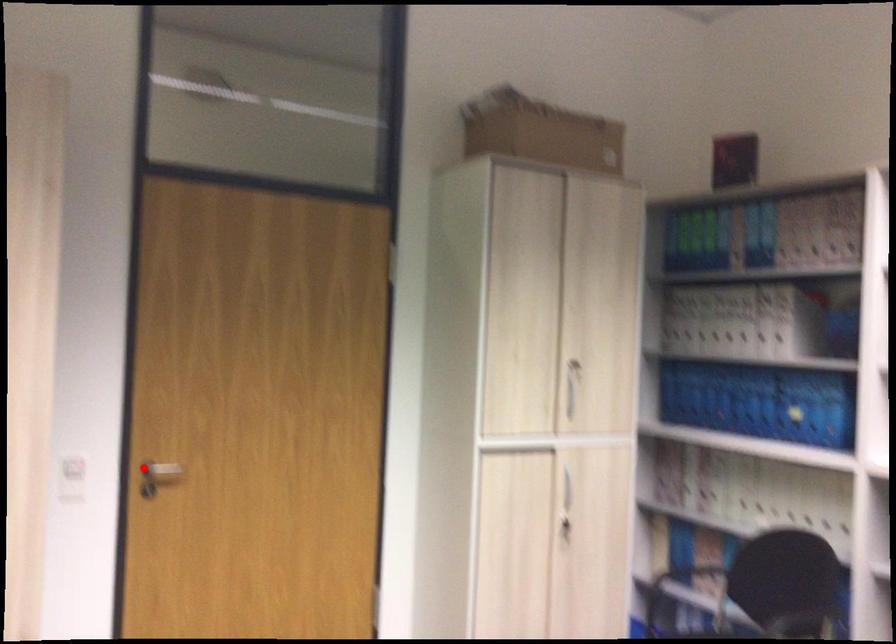
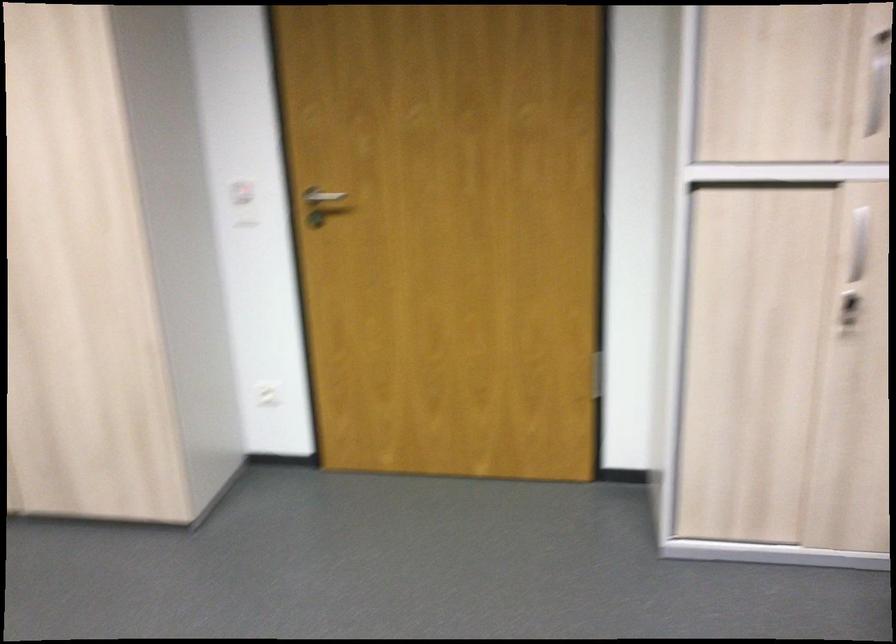
Where in the second image is the point corresponding to the highlighted location from the first image?

(321, 204)